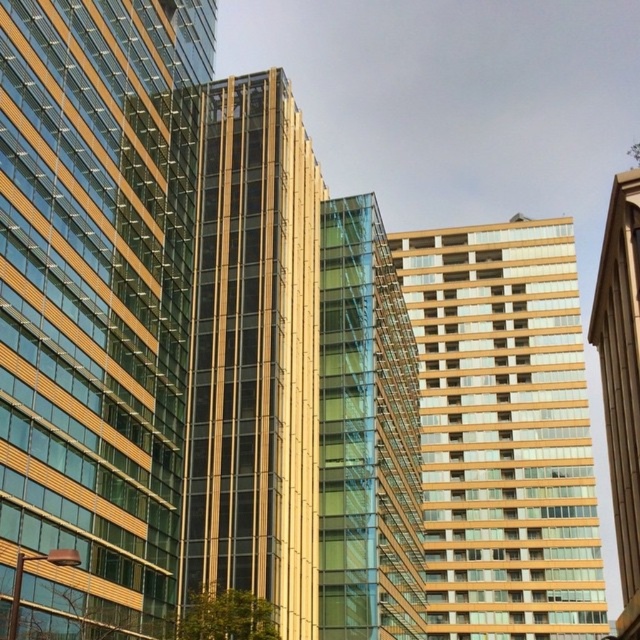
Question: Does gold glass tower at center appear under gold glass tower at right?

Choices:
 (A) no
 (B) yes

Answer: (B)

Question: Which of the following is the farthest from the observer?

Choices:
 (A) gold glass building at center
 (B) green glass building at center

Answer: (A)

Question: Which of these objects is positioned farthest from the green glass building at center?

Choices:
 (A) matte glass building at center
 (B) gold glass tower at center
 (C) gold glass tower at right
 (D) gold glass building at center

Answer: (A)

Question: Is gold glass building at center further to the viewer compared to gold glass tower at center?

Choices:
 (A) yes
 (B) no

Answer: (A)

Question: Is matte glass building at center to the right of gold glass tower at center from the viewer's perspective?

Choices:
 (A) no
 (B) yes

Answer: (A)

Question: Based on their relative distances, which object is farther from the green glass building at center?

Choices:
 (A) matte glass building at center
 (B) gold glass building at center
 (C) gold glass tower at right

Answer: (A)